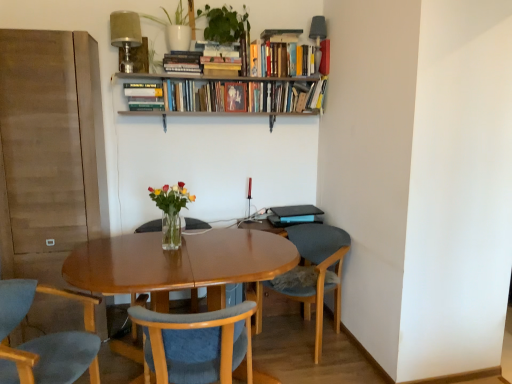
Find the location of `clear glass vase at center`. clear glass vase at center is located at coordinates (170, 231).

In order to face wooden textured chair at center, which is the second chair in left-to-right order, should I rotate leftwards or rightwards?

You should rotate left by 8.021 degrees.

Identify the location of hardcover books at upper center, which is the 2th book in right-to-left order. (284, 55).

What is the approximate width of white matte pot at upper center?

9.63 inches.

Image resolution: width=512 pixels, height=384 pixels. What do you see at coordinates (51, 359) in the screenshot?
I see `blue fabric chair at lower left, the third chair positioned from the right` at bounding box center [51, 359].

What do you see at coordinates (182, 62) in the screenshot? The image size is (512, 384). I see `hardcover books at upper center, the 2th book in the left-to-right sequence` at bounding box center [182, 62].

The image size is (512, 384). I want to click on clear glass vase at center, so pos(170,231).

Is hardcover books at upper center, which is counted as the fourth book, starting from the left, aimed at green matte plant at upper center?

No, hardcover books at upper center, which is counted as the fourth book, starting from the left, is not oriented towards green matte plant at upper center.

From a real-world perspective, is hardcover books at upper center, which is counted as the fourth book, starting from the left, physically located above or below green matte plant at upper center?

From a real-world perspective, hardcover books at upper center, which is counted as the fourth book, starting from the left, is physically below green matte plant at upper center.

Considering the sizes of objects hardcover books at upper center, the 3th book in the right-to-left sequence, and green matte plant at upper center in the image provided, who is wider, hardcover books at upper center, the 3th book in the right-to-left sequence, or green matte plant at upper center?

green matte plant at upper center.

Is hardcover book at upper center, which is the 6th book in right-to-left order, positioned far away from blue fabric chair at lower left, the third chair positioned from the right?

hardcover book at upper center, which is the 6th book in right-to-left order, is far away from blue fabric chair at lower left, the third chair positioned from the right.

Considering the sizes of objects hardcover book at upper center, which is the 6th book in right-to-left order, and blue fabric chair at lower left, the third chair positioned from the right, in the image provided, who is smaller, hardcover book at upper center, which is the 6th book in right-to-left order, or blue fabric chair at lower left, the third chair positioned from the right,?

With smaller size is hardcover book at upper center, which is the 6th book in right-to-left order.

From a real-world perspective, is hardcover book at upper center, the first book viewed from the left, above or below blue fabric chair at lower left, acting as the first chair starting from the left?

hardcover book at upper center, the first book viewed from the left, is above blue fabric chair at lower left, acting as the first chair starting from the left.

How different are the orientations of hardcover book at upper center, the sixth book from the left, and hardcover books at upper center, acting as the 5th book starting from the left, in degrees?

There is a 0.991-degree angle between the facing directions of hardcover book at upper center, the sixth book from the left, and hardcover books at upper center, acting as the 5th book starting from the left.

Is the surface of hardcover book at upper center, marked as the 1th book in a right-to-left arrangement, in direct contact with hardcover books at upper center, acting as the 5th book starting from the left?

No, hardcover book at upper center, marked as the 1th book in a right-to-left arrangement, is not with hardcover books at upper center, acting as the 5th book starting from the left.

Is the depth of hardcover book at upper center, marked as the 1th book in a right-to-left arrangement, less than that of hardcover books at upper center, acting as the 5th book starting from the left?

No, it is not.

Image resolution: width=512 pixels, height=384 pixels. Find the location of `book above the hardcover books at upper center, acting as the 5th book starting from the left (from the image's perspective)`. book above the hardcover books at upper center, acting as the 5th book starting from the left (from the image's perspective) is located at coordinates (324, 57).

From a real-world perspective, is matte black photo frame at upper center, the third book in the left-to-right sequence, positioned over white matte pot at upper center based on gravity?

No, from a real-world perspective, matte black photo frame at upper center, the third book in the left-to-right sequence, is not over white matte pot at upper center

Is matte black photo frame at upper center, the third book in the left-to-right sequence, in contact with white matte pot at upper center?

No, matte black photo frame at upper center, the third book in the left-to-right sequence, is not with white matte pot at upper center.

From the image's perspective, relative to white matte pot at upper center, is matte black photo frame at upper center, the third book in the left-to-right sequence, above or below?

Clearly, from the image's perspective, matte black photo frame at upper center, the third book in the left-to-right sequence, is below white matte pot at upper center.

Considering the sizes of objects matte black photo frame at upper center, the third book in the left-to-right sequence, and white matte pot at upper center in the image provided, who is shorter, matte black photo frame at upper center, the third book in the left-to-right sequence, or white matte pot at upper center?

Standing shorter between the two is matte black photo frame at upper center, the third book in the left-to-right sequence.

Between hardcover books at upper center, the 3th book in the right-to-left sequence, and translucent glass vase at center, which one has smaller size?

Smaller between the two is translucent glass vase at center.

Is translucent glass vase at center located within hardcover books at upper center, which is counted as the fourth book, starting from the left?

No, hardcover books at upper center, which is counted as the fourth book, starting from the left, does not contain translucent glass vase at center.

From a real-world perspective, is hardcover books at upper center, which is counted as the fourth book, starting from the left, below translucent glass vase at center?

No, from a real-world perspective, hardcover books at upper center, which is counted as the fourth book, starting from the left, is not under translucent glass vase at center.

Measure the distance from hardcover books at upper center, which is the 2th book in right-to-left order, to blue fabric chair at lower right, the 3th chair when ordered from left to right.

The distance of hardcover books at upper center, which is the 2th book in right-to-left order, from blue fabric chair at lower right, the 3th chair when ordered from left to right, is 1.32 meters.

Can you tell me how much hardcover books at upper center, which is the 2th book in right-to-left order, and blue fabric chair at lower right, the 3th chair when ordered from left to right, differ in facing direction?

The angular difference between hardcover books at upper center, which is the 2th book in right-to-left order, and blue fabric chair at lower right, the 3th chair when ordered from left to right, is 56.2 degrees.

In the image, is hardcover books at upper center, acting as the 5th book starting from the left, on the left side or the right side of blue fabric chair at lower right, which is the 1th chair in right-to-left order?

hardcover books at upper center, acting as the 5th book starting from the left, is to the left of blue fabric chair at lower right, which is the 1th chair in right-to-left order.

Does hardcover books at upper center, which is the 2th book in right-to-left order, touch blue fabric chair at lower right, which is the 1th chair in right-to-left order?

hardcover books at upper center, which is the 2th book in right-to-left order, is not next to blue fabric chair at lower right, which is the 1th chair in right-to-left order, and they're not touching.

Based on the photo, does green matte plant at upper center turn towards white matte pot at upper center?

No, green matte plant at upper center does not turn towards white matte pot at upper center.

Which of these two, green matte plant at upper center or white matte pot at upper center, is smaller?

Smaller between the two is white matte pot at upper center.

Is the depth of green matte plant at upper center less than that of white matte pot at upper center?

Yes, green matte plant at upper center is in front of white matte pot at upper center.

Is white matte pot at upper center completely or partially inside green matte plant at upper center?

No, green matte plant at upper center does not contain white matte pot at upper center.

I want to click on houseplant located on the left of hardcover books at upper center, the 3th book in the right-to-left sequence, so click(225, 24).

From the blue fabric chair at lower left, the third chair positioned from the right, count 2nd books backward and point to it. Please provide its 2D coordinates.

[(144, 96)]

Based on their spatial positions, is green matte plant at upper center or wooden textured chair at center, which is the second chair in left-to-right order, closer to hardcover book at upper center, which is the 6th book in right-to-left order?

green matte plant at upper center.

Looking at the image, which one is located closer to satin beige lampshade at upper center, translucent glass vase at center or hardcover books at upper center, acting as the 5th book starting from the left?

hardcover books at upper center, acting as the 5th book starting from the left.

Which object lies nearer to the anchor point wooden textured chair at center, which is the second chair in left-to-right order, white matte pot at upper center or hardcover books at upper center, which is the 2th book in right-to-left order?

hardcover books at upper center, which is the 2th book in right-to-left order, lies closer to wooden textured chair at center, which is the second chair in left-to-right order, than the other object.

From the image, which object appears to be nearer to white matte pot at upper center, hardcover book at upper center, the sixth book from the left, or blue fabric chair at lower right, the 3th chair when ordered from left to right?

hardcover book at upper center, the sixth book from the left, is closer to white matte pot at upper center.

From the image, which object appears to be nearer to hardcover books at upper center, which is counted as the fourth book, starting from the left, hardcover books at upper center, which is counted as the 5th book, starting from the right, or wooden textured chair at center, which appears as the 2th chair when viewed from the right?

hardcover books at upper center, which is counted as the 5th book, starting from the right, is positioned closer to the anchor hardcover books at upper center, which is counted as the fourth book, starting from the left.

Which object lies nearer to the anchor point wooden textured chair at center, which appears as the 2th chair when viewed from the right, hardcover book at upper center, marked as the 1th book in a right-to-left arrangement, or white matte pot at upper center?

white matte pot at upper center.

Estimate the real-world distances between objects in this image. Which object is further from clear glass vase at center, translucent glass vase at center or wooden textured chair at center, which appears as the 2th chair when viewed from the right?

wooden textured chair at center, which appears as the 2th chair when viewed from the right, is positioned further to the anchor clear glass vase at center.

Which object lies further to the anchor point hardcover books at upper center, the 2th book in the left-to-right sequence, hardcover books at upper center, which is the 2th book in right-to-left order, or green matte plant at upper center?

hardcover books at upper center, which is the 2th book in right-to-left order, is positioned further to the anchor hardcover books at upper center, the 2th book in the left-to-right sequence.

Find the location of a particular element. This screenshot has width=512, height=384. chair between matte black photo frame at upper center, the third book in the left-to-right sequence, and blue fabric chair at lower left, the third chair positioned from the right, from top to bottom is located at coordinates (318, 273).

You are a GUI agent. You are given a task and a screenshot of the screen. Output one action in this format:
    pyautogui.click(x=<x>, y=<y>)
    Task: Click on the floral arrangement between satin beige lampshade at upper center and blue fabric chair at lower left, the third chair positioned from the right, in the vertical direction
    The width and height of the screenshot is (512, 384).
    Given the screenshot: What is the action you would take?
    pyautogui.click(x=170, y=211)

Where is `vase between hardcover books at upper center, the 2th book in the left-to-right sequence, and blue fabric chair at lower left, the third chair positioned from the right, vertically`? Image resolution: width=512 pixels, height=384 pixels. vase between hardcover books at upper center, the 2th book in the left-to-right sequence, and blue fabric chair at lower left, the third chair positioned from the right, vertically is located at coordinates click(170, 231).

At what (x,y) coordinates should I click in order to perform the action: click on floral arrangement between hardcover books at upper center, which is counted as the fourth book, starting from the left, and wooden textured chair at center, which is the second chair in left-to-right order, in the vertical direction. Please return your answer as a coordinate pair (x, y). Image resolution: width=512 pixels, height=384 pixels. Looking at the image, I should click on (170, 211).